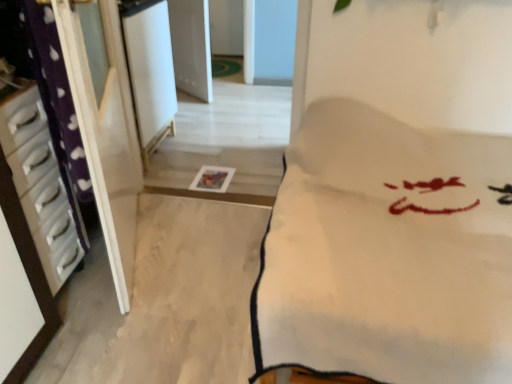
This screenshot has height=384, width=512. In order to click on vacant region below white glossy drawer at left, marked as the first furniture in a left-to-right arrangement (from a real-world perspective) in this screenshot , I will do `click(74, 289)`.